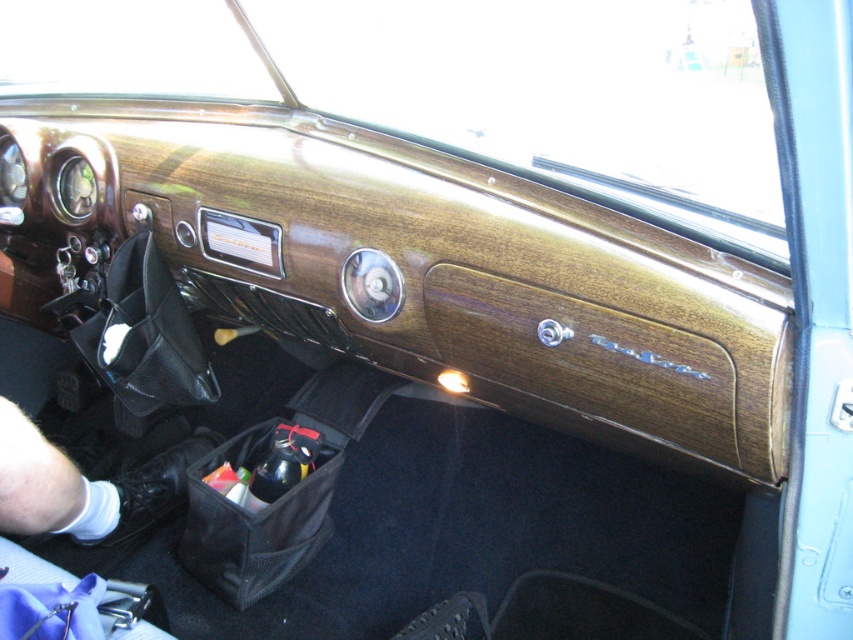
Question: Can you confirm if black mesh bag at lower center is positioned above black leather glove at lower left?

Choices:
 (A) no
 (B) yes

Answer: (A)

Question: Can you confirm if black mesh bag at lower center is smaller than black leather glove at lower left?

Choices:
 (A) yes
 (B) no

Answer: (A)

Question: Which of the following is the closest to the observer?

Choices:
 (A) [236, 589]
 (B) [96, 488]

Answer: (A)

Question: Is black mesh bag at lower center wider than black leather glove at lower left?

Choices:
 (A) no
 (B) yes

Answer: (B)